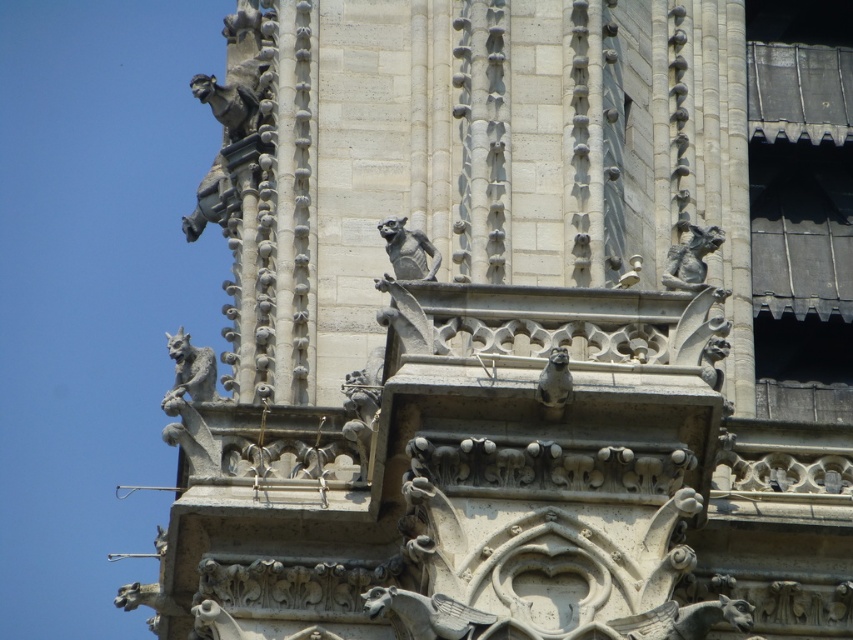
Question: Considering the relative positions of slate gray stone gargoyle at center and sculpted stone gargoyle at upper right in the image provided, where is slate gray stone gargoyle at center located with respect to sculpted stone gargoyle at upper right?

Choices:
 (A) below
 (B) above

Answer: (A)

Question: Does slate gray stone gargoyle at center have a larger size compared to matte stone gargoyle at center?

Choices:
 (A) yes
 (B) no

Answer: (A)

Question: Which object is positioned farthest from the matte stone gargoyle at center?

Choices:
 (A) slate gray stone gargoyle at center
 (B) sculpted stone gargoyle at upper right

Answer: (B)

Question: Which of the following is the closest to the observer?

Choices:
 (A) sculpted stone gargoyle at upper right
 (B) matte stone gargoyle at center
 (C) slate gray stone gargoyle at center

Answer: (B)

Question: Considering the relative positions of sculpted stone gargoyle at upper right and matte stone gargoyle at center in the image provided, where is sculpted stone gargoyle at upper right located with respect to matte stone gargoyle at center?

Choices:
 (A) right
 (B) left

Answer: (A)

Question: Which object is farther from the camera taking this photo?

Choices:
 (A) sculpted stone gargoyle at upper right
 (B) slate gray stone gargoyle at center

Answer: (A)